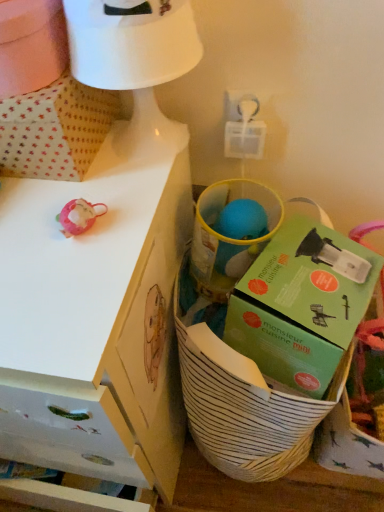
The width and height of the screenshot is (384, 512). Identify the location of free location in front of white matte table lamp at upper center. (108, 216).